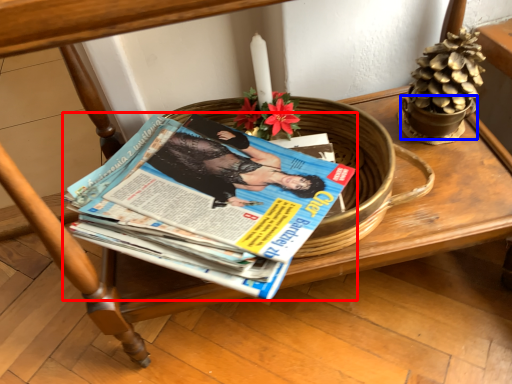
Question: Which point is closer to the camera, book (highlighted by a red box) or flowerpot (highlighted by a blue box)?

Choices:
 (A) book
 (B) flowerpot

Answer: (A)